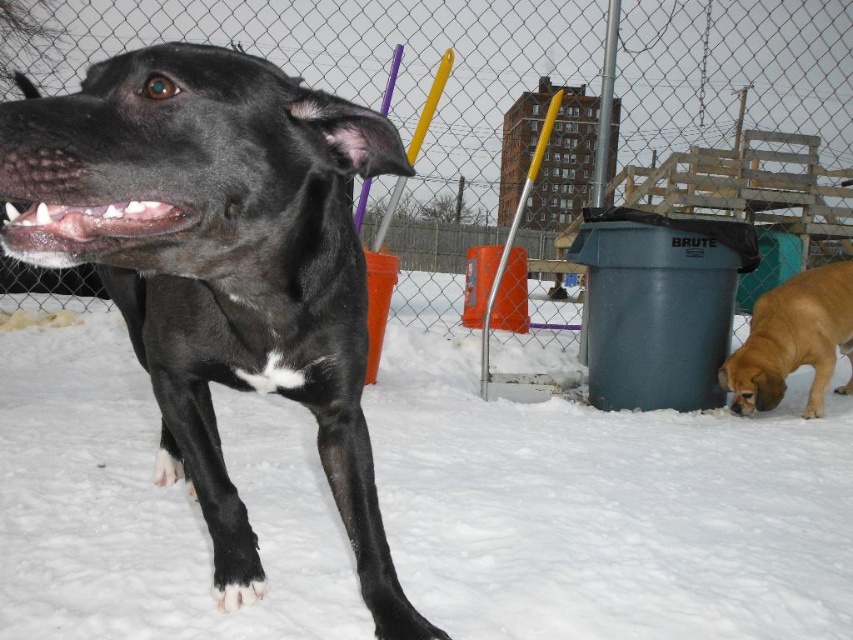
Question: Which of the following is the closest to the observer?

Choices:
 (A) (x=846, y=381)
 (B) (x=685, y=115)
 (C) (x=351, y=637)
 (D) (x=190, y=192)

Answer: (D)

Question: Which object appears closest to the camera in this image?

Choices:
 (A) black glossy dog at left
 (B) metal chain-link fence at upper center
 (C) white fluffy snow at lower left

Answer: (A)

Question: Which of the following is the farthest from the observer?

Choices:
 (A) (181, 36)
 (B) (801, 540)
 (C) (740, 400)

Answer: (A)

Question: Does metal chain-link fence at upper center lie in front of golden brown fur at lower right?

Choices:
 (A) no
 (B) yes

Answer: (A)

Question: Does white fluffy snow at lower left appear on the right side of black glossy dog at left?

Choices:
 (A) yes
 (B) no

Answer: (B)

Question: Is the position of metal chain-link fence at upper center less distant than that of golden brown fur at lower right?

Choices:
 (A) yes
 (B) no

Answer: (B)